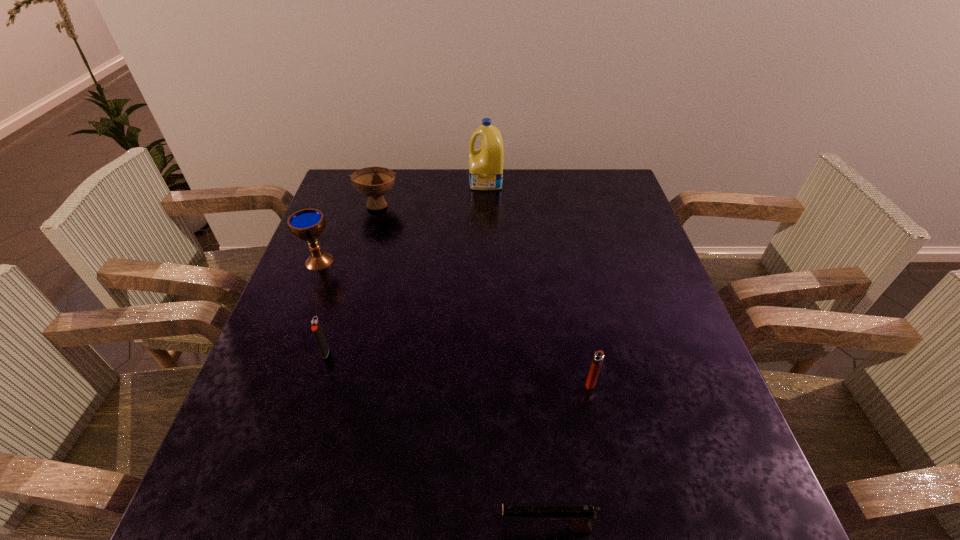
What are the coordinates of `detergent present at the far edge` in the screenshot? It's located at (485, 163).

Image resolution: width=960 pixels, height=540 pixels. I want to click on soup bowl that is at the far edge, so pos(374,182).

Locate an element on the screen. Image resolution: width=960 pixels, height=540 pixels. object at the near edge is located at coordinates (578, 516).

The image size is (960, 540). In order to click on chalice present at the left edge in this screenshot , I will do `click(307, 224)`.

I want to click on soup bowl situated at the left edge, so click(x=374, y=182).

Image resolution: width=960 pixels, height=540 pixels. Identify the location of igniter located at the left edge. (316, 328).

I want to click on object positioned at the far left corner, so click(374, 182).

In the image, there is a desktop. At what (x,y) coordinates should I click in order to perform the action: click on blank space at the far edge. Please return your answer as a coordinate pair (x, y). The width and height of the screenshot is (960, 540). Looking at the image, I should click on (449, 199).

This screenshot has width=960, height=540. In the image, there is a desktop. In order to click on vacant space at the near edge in this screenshot , I will do click(x=351, y=480).

I want to click on free location at the right edge of the desktop, so click(623, 342).